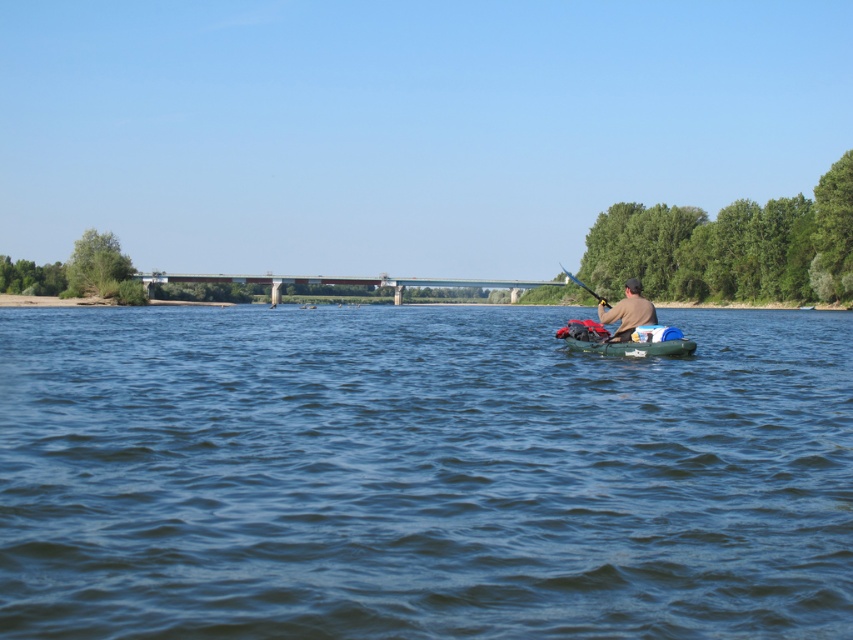
Question: Can you confirm if brown leather jacket at center is positioned above metallic blue paddle at center-right?

Choices:
 (A) yes
 (B) no

Answer: (B)

Question: Which of the following is the farthest from the observer?

Choices:
 (A) brown leather jacket at center
 (B) translucent blue kayak at center

Answer: (A)

Question: Does blue water at center have a lesser width compared to translucent blue kayak at center?

Choices:
 (A) no
 (B) yes

Answer: (A)

Question: Can you confirm if translucent blue kayak at center is thinner than brown leather jacket at center?

Choices:
 (A) no
 (B) yes

Answer: (B)

Question: Which object is the farthest from the blue water at center?

Choices:
 (A) metallic blue paddle at center-right
 (B) brown leather jacket at center
 (C) translucent blue kayak at center

Answer: (C)

Question: Which point is farther to the camera?

Choices:
 (A) translucent blue kayak at center
 (B) blue water at center

Answer: (A)